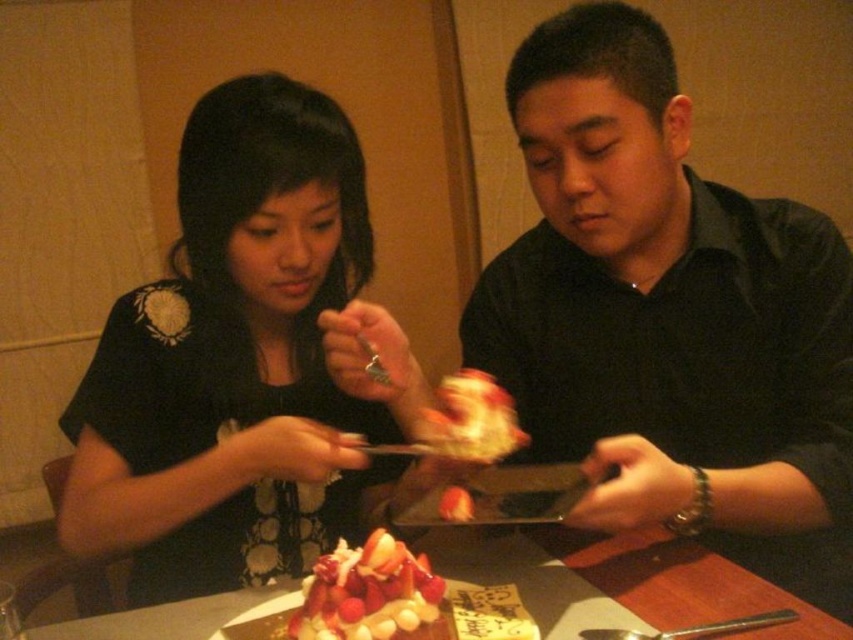
Question: Which object appears farthest from the camera in this image?

Choices:
 (A) wooden table at center
 (B) frosted white cake at center
 (C) matte black dress at center
 (D) slightly blurred white cake at center

Answer: (C)

Question: Among these points, which one is nearest to the camera?

Choices:
 (A) (485, 435)
 (B) (44, 541)
 (C) (335, 600)

Answer: (C)

Question: Where is wooden table at center located in relation to slightly blurred white cake at center in the image?

Choices:
 (A) right
 (B) left

Answer: (B)

Question: Is matte black dress at center closer to camera compared to slightly blurred white cake at center?

Choices:
 (A) no
 (B) yes

Answer: (A)

Question: Which object is farther from the camera taking this photo?

Choices:
 (A) wooden table at center
 (B) frosted white cake at center
 (C) matte black dress at center
 (D) slightly blurred white cake at center

Answer: (C)

Question: Is the position of wooden table at center less distant than that of frosted white cake at center?

Choices:
 (A) yes
 (B) no

Answer: (B)